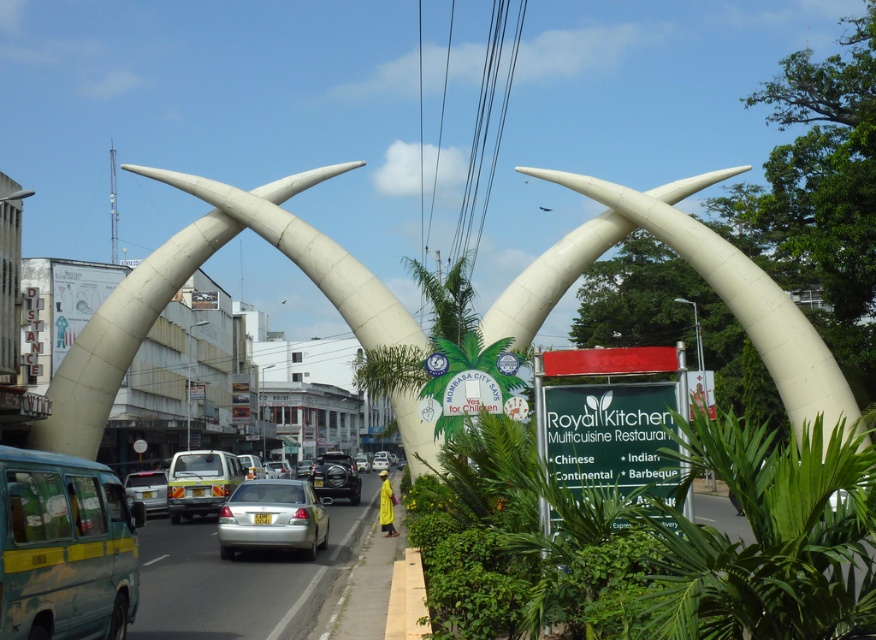
Can you confirm if blue matte van at left is thinner than silver metallic car at center?

Indeed, blue matte van at left has a lesser width compared to silver metallic car at center.

Find the location of a particular element. blue matte van at left is located at coordinates (64, 547).

Identify the location of blue matte van at left. (64, 547).

Which of these two, white polished stone arches at center or shiny black car at center, stands shorter?

shiny black car at center

Is point (629, 221) farther from viewer compared to point (333, 492)?

No.

Is point (504, 310) in front of point (316, 488)?

Yes.

Identify the location of white polished stone arches at center. (705, 282).

Identify the location of satin silver sedan at center. click(272, 516).

This screenshot has width=876, height=640. What do you see at coordinates (272, 516) in the screenshot?
I see `satin silver sedan at center` at bounding box center [272, 516].

This screenshot has width=876, height=640. What do you see at coordinates (272, 516) in the screenshot?
I see `satin silver sedan at center` at bounding box center [272, 516].

This screenshot has height=640, width=876. Identify the location of satin silver sedan at center. (272, 516).